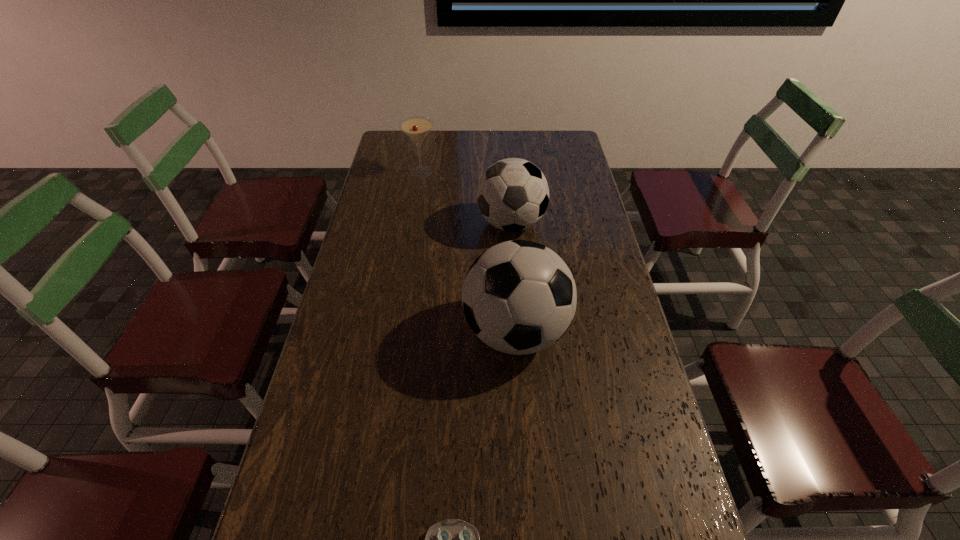
Where is `free space between the tallest object and the martini`? The height and width of the screenshot is (540, 960). free space between the tallest object and the martini is located at coordinates (468, 252).

In order to click on vacant space that's between the nearer soccer ball and the martini in this screenshot , I will do 468,252.

Image resolution: width=960 pixels, height=540 pixels. I want to click on blank region between the farthest object and the farther soccer ball, so click(467, 198).

Locate an element on the screen. This screenshot has height=540, width=960. unoccupied area between the shorter soccer ball and the martini is located at coordinates (467, 198).

You are a GUI agent. You are given a task and a screenshot of the screen. Output one action in this format:
    pyautogui.click(x=<x>, y=<y>)
    Task: Click on the object that is the second closest one to the taller soccer ball
    
    Given the screenshot: What is the action you would take?
    pyautogui.click(x=458, y=539)

Identify which object is the second nearest to the shortest object. Please provide its 2D coordinates. Your answer should be formatted as a tuple, i.e. [(x, y)], where the tuple contains the x and y coordinates of a point satisfying the conditions above.

[(512, 194)]